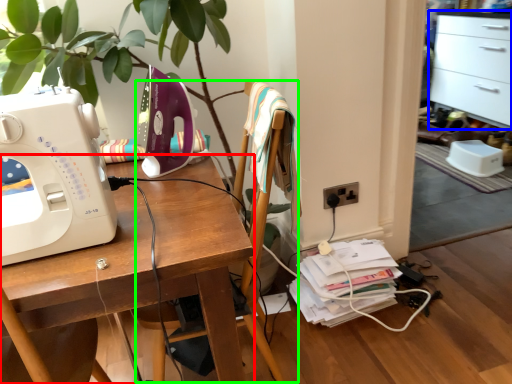
Question: Which object is positioned closest to desk (highlighted by a red box)? Select from file cabinet (highlighted by a blue box) and chair (highlighted by a green box).

Choices:
 (A) file cabinet
 (B) chair

Answer: (B)